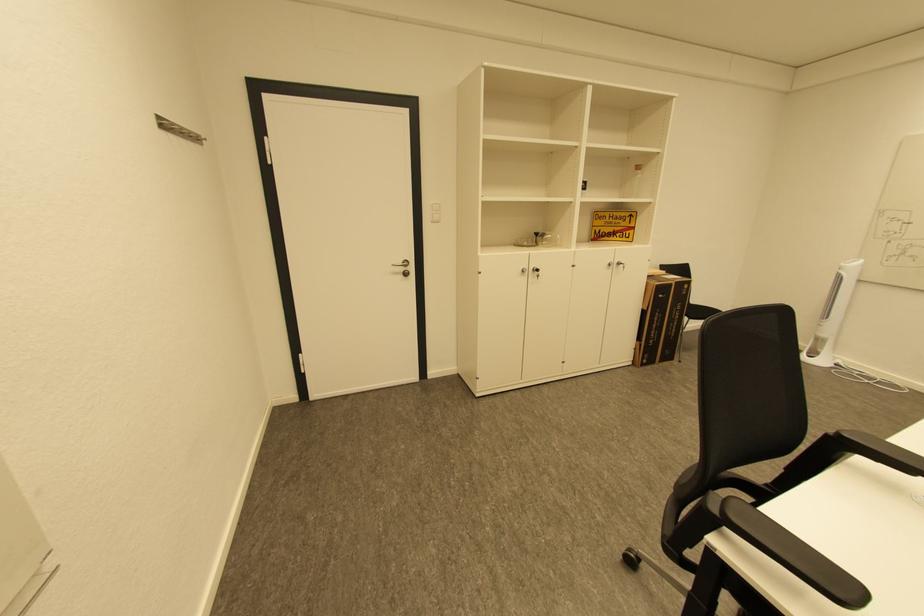
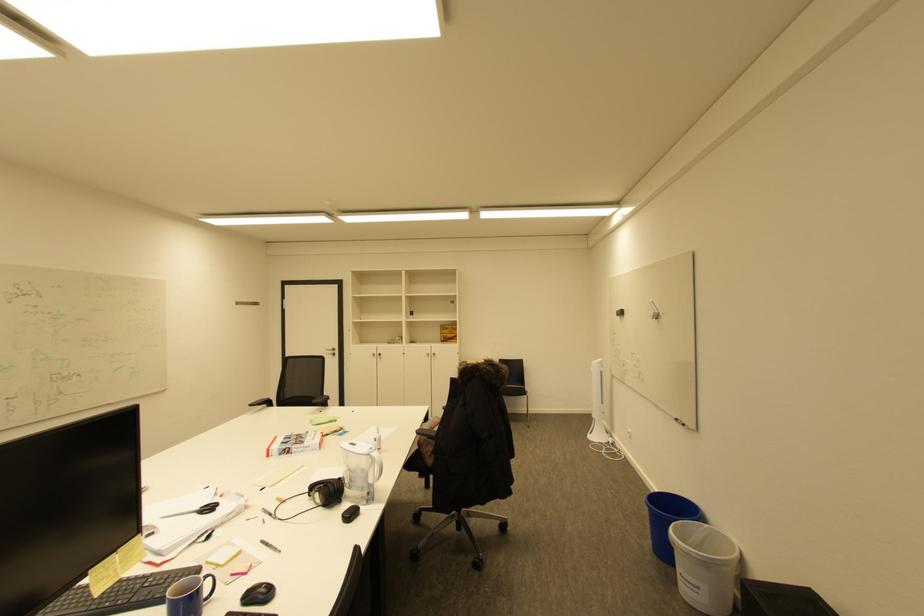
In the scene shown: In a continuous first-person perspective shot, in which direction is the camera moving?

The cameraman walked toward right, backward.